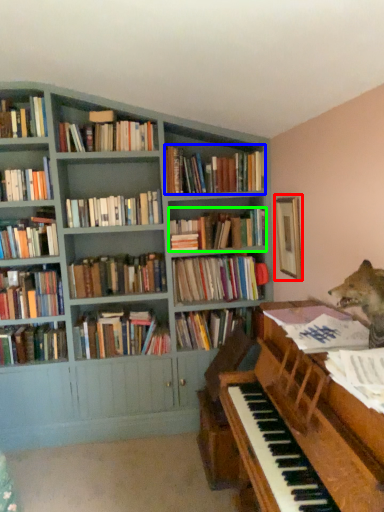
Question: Which object is positioned farthest from picture frame (highlighted by a red box)? Select from book (highlighted by a blue box) and book (highlighted by a green box).

Choices:
 (A) book
 (B) book

Answer: (A)